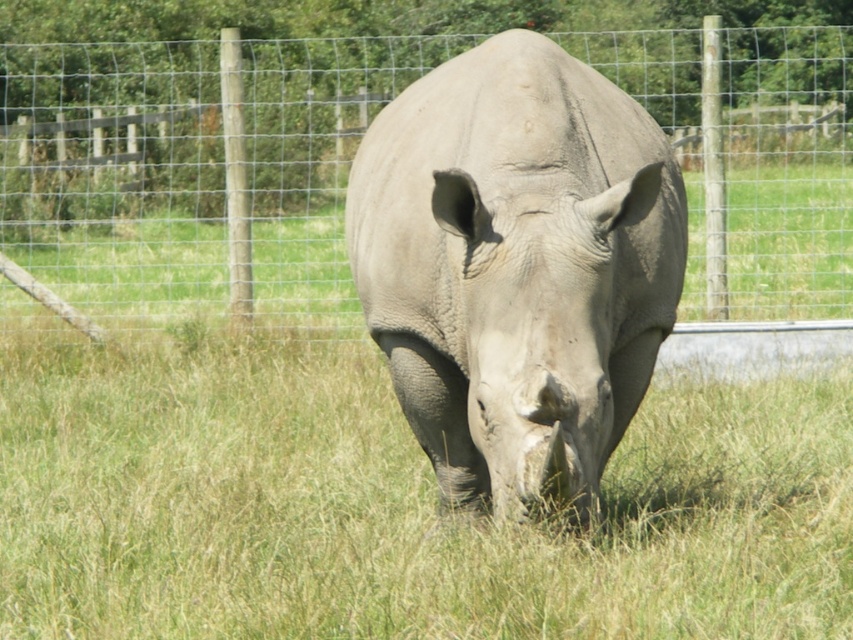
Question: Does wire mesh fence at center have a larger size compared to gray matte rhinoceros at center?

Choices:
 (A) yes
 (B) no

Answer: (A)

Question: Which object is closer to the camera taking this photo?

Choices:
 (A) wire mesh fence at center
 (B) gray matte rhinoceros at center

Answer: (B)

Question: Can you confirm if wire mesh fence at center is positioned above gray matte rhinoceros at center?

Choices:
 (A) no
 (B) yes

Answer: (B)

Question: Does wire mesh fence at center appear over gray matte rhinoceros at center?

Choices:
 (A) no
 (B) yes

Answer: (B)